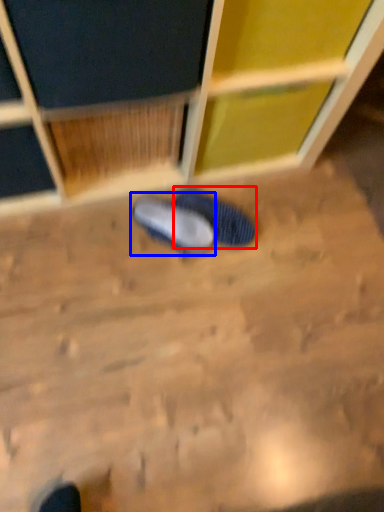
Question: Which of the following is the closest to the observer, footwear (highlighted by a red box) or footwear (highlighted by a blue box)?

Choices:
 (A) footwear
 (B) footwear

Answer: (B)